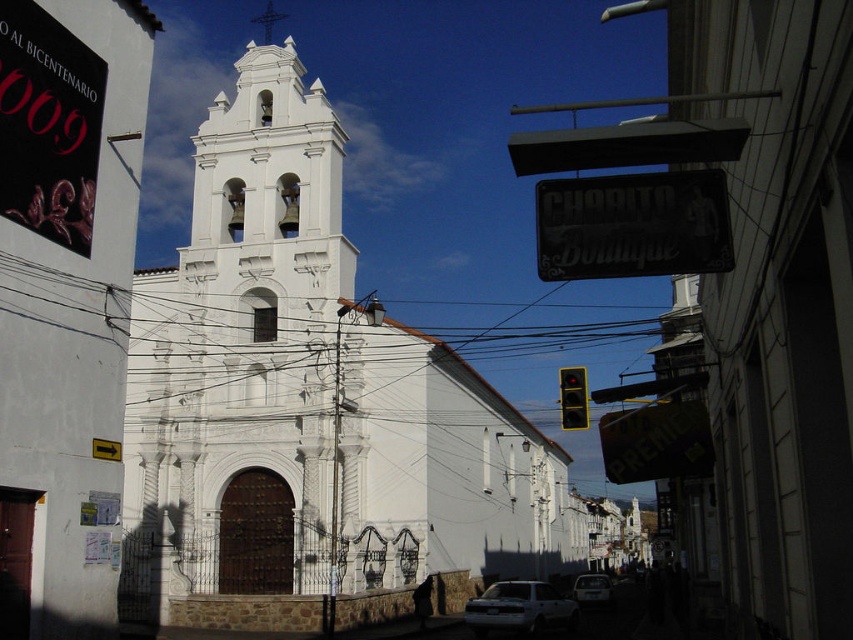
How much distance is there between white stone church at center and yellow matte traffic light at center?

The distance of white stone church at center from yellow matte traffic light at center is 82.76 feet.

Can you confirm if white stone church at center is thinner than yellow matte traffic light at center?

Incorrect, white stone church at center's width is not less than yellow matte traffic light at center's.

Measure the distance between white stone church at center and camera.

white stone church at center is 58.21 meters from camera.

This screenshot has width=853, height=640. I want to click on white stone church at center, so click(x=309, y=400).

Find the location of a particular element. black metal sign at upper center is located at coordinates click(x=633, y=225).

Where is `black metal sign at upper center`? The image size is (853, 640). black metal sign at upper center is located at coordinates (633, 225).

Can you confirm if black metal sign at upper center is thinner than white glossy car at center?

Yes.

Can you confirm if black metal sign at upper center is taller than white glossy car at center?

Incorrect, black metal sign at upper center's height is not larger of white glossy car at center's.

Between point (680, 273) and point (583, 604), which one is positioned in front?

Point (680, 273) is in front.

You are a GUI agent. You are given a task and a screenshot of the screen. Output one action in this format:
    pyautogui.click(x=<x>, y=<y>)
    Task: Click on the black metal sign at upper center
    
    Given the screenshot: What is the action you would take?
    pyautogui.click(x=633, y=225)